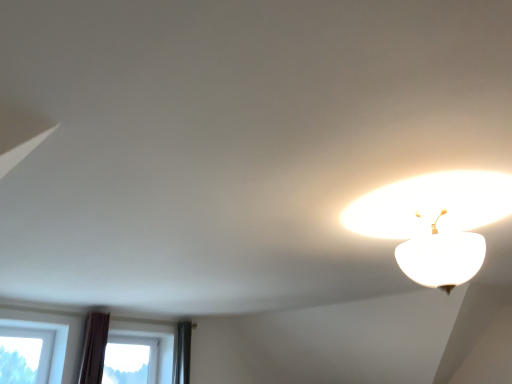
Measure the distance between white glossy lampshade at upper right and camera.

5.45 feet.

Find the location of `white glossy lampshade at upper right`. white glossy lampshade at upper right is located at coordinates (431, 205).

What do you see at coordinates (431, 205) in the screenshot? Image resolution: width=512 pixels, height=384 pixels. I see `white glossy lampshade at upper right` at bounding box center [431, 205].

Find the location of a particular element. The height and width of the screenshot is (384, 512). white glossy lampshade at upper right is located at coordinates (431, 205).